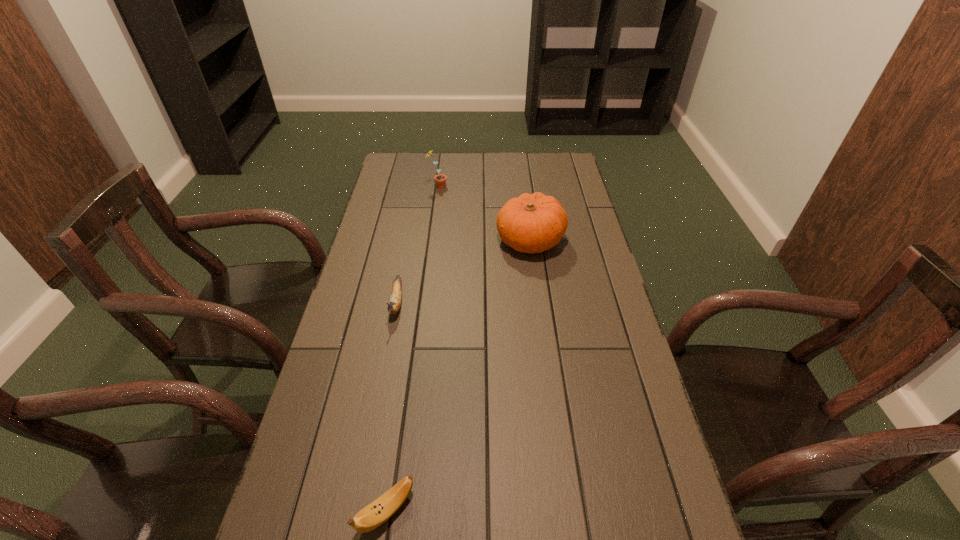
You are a GUI agent. You are given a task and a screenshot of the screen. Output one action in this format:
    pyautogui.click(x=<x>, y=<y>)
    Task: Click on the sunflower
    This screenshot has height=540, width=960.
    Given the screenshot: What is the action you would take?
    pyautogui.click(x=440, y=179)

Locate an element on the screen. pumpkin is located at coordinates (532, 223).

Identify the location of the third nearest object. The width and height of the screenshot is (960, 540). (532, 223).

Identify the location of the second nearest object. (396, 295).

In order to click on vacant space located 0.370m on the flower of the sunflower in this screenshot , I will do `click(537, 187)`.

Find the location of `vacant region located on the back of the rightmost object`. vacant region located on the back of the rightmost object is located at coordinates (524, 192).

This screenshot has width=960, height=540. Find the location of `vacant space located 0.170m on the peel of the farther banana`. vacant space located 0.170m on the peel of the farther banana is located at coordinates (383, 373).

This screenshot has width=960, height=540. What are the coordinates of `object situated at the left edge` in the screenshot? It's located at (396, 295).

At what (x,y) coordinates should I click in order to perform the action: click on object at the right edge. Please return your answer as a coordinate pair (x, y). The image size is (960, 540). Looking at the image, I should click on (532, 223).

Identify the location of vacant region at the far edge of the desktop. The height and width of the screenshot is (540, 960). (492, 155).